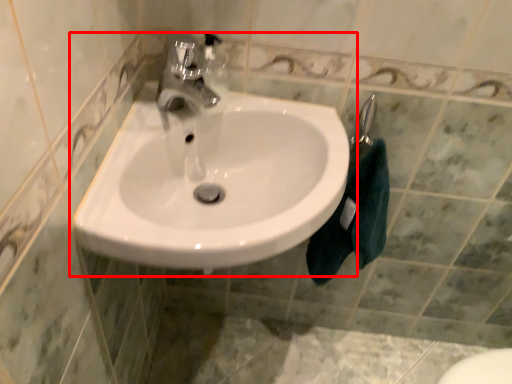
Question: From the image's perspective, where is sink (annotated by the red box) located in relation to bath towel in the image?

Choices:
 (A) below
 (B) above

Answer: (B)